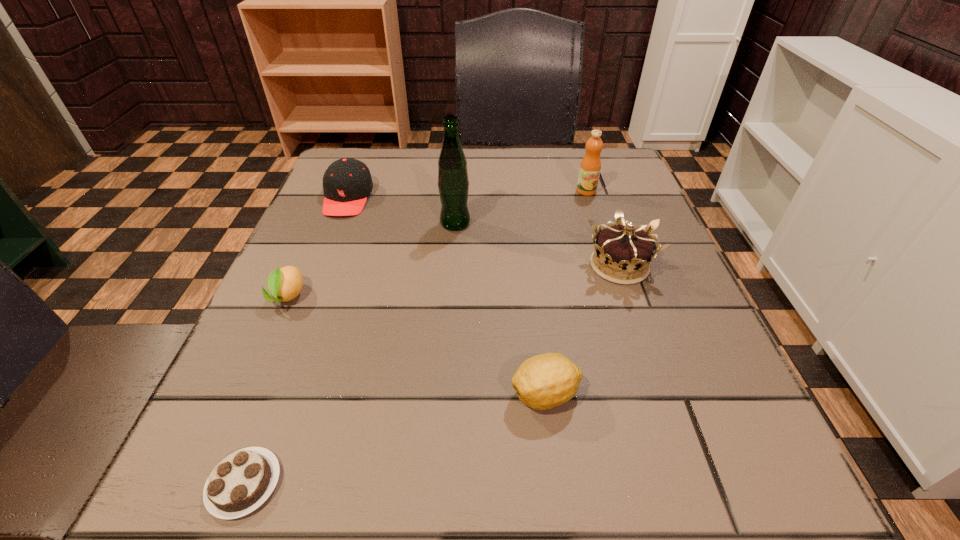
Where is `the nearest object`? This screenshot has height=540, width=960. the nearest object is located at coordinates (239, 484).

Find the location of a particular element. vacant position located on the front of the tallest object is located at coordinates (444, 389).

The width and height of the screenshot is (960, 540). In order to click on vacant space situated on the front label of the orange juice in this screenshot , I will do `click(611, 267)`.

Find the location of `vacant space positioned on the back of the crown`. vacant space positioned on the back of the crown is located at coordinates (586, 170).

Where is `vacant space located on the front-facing side of the cap`? Image resolution: width=960 pixels, height=540 pixels. vacant space located on the front-facing side of the cap is located at coordinates (318, 273).

The width and height of the screenshot is (960, 540). I want to click on vacant space situated at the stem end of the nearer lemon, so click(383, 395).

What are the coordinates of `vacant area situated at the stem end of the nearer lemon` in the screenshot? It's located at (419, 395).

Find the location of a particular element. The width and height of the screenshot is (960, 540). free space located at the stem end of the nearer lemon is located at coordinates (291, 395).

Locate an element on the screen. The image size is (960, 540). blank space located with leaves positioned above the farther lemon is located at coordinates (245, 394).

Locate an element on the screen. The height and width of the screenshot is (540, 960). vacant space positioned on the back of the shortest object is located at coordinates (278, 395).